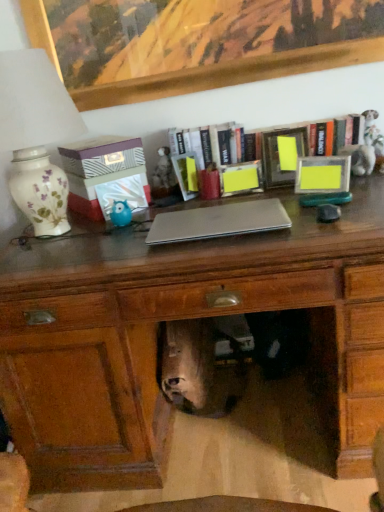
Question: Is matte wooden desk at center behind matte blue plastic owl at center-left?

Choices:
 (A) yes
 (B) no

Answer: (B)

Question: Does matte wooden desk at center have a larger size compared to matte blue plastic owl at center-left?

Choices:
 (A) yes
 (B) no

Answer: (A)

Question: Can you confirm if matte wooden desk at center is smaller than matte blue plastic owl at center-left?

Choices:
 (A) no
 (B) yes

Answer: (A)

Question: Does matte wooden desk at center have a greater width compared to matte blue plastic owl at center-left?

Choices:
 (A) yes
 (B) no

Answer: (A)

Question: From a real-world perspective, is matte wooden desk at center located beneath matte blue plastic owl at center-left?

Choices:
 (A) yes
 (B) no

Answer: (A)

Question: From the image's perspective, is matte wooden desk at center beneath matte blue plastic owl at center-left?

Choices:
 (A) yes
 (B) no

Answer: (A)

Question: Can you confirm if silver metallic laptop at center is positioned to the right of white floral ceramic lamp at left?

Choices:
 (A) no
 (B) yes

Answer: (B)

Question: Is silver metallic laptop at center thinner than white floral ceramic lamp at left?

Choices:
 (A) yes
 (B) no

Answer: (A)

Question: Can you see silver metallic laptop at center touching white floral ceramic lamp at left?

Choices:
 (A) yes
 (B) no

Answer: (B)

Question: From a real-world perspective, is silver metallic laptop at center positioned under white floral ceramic lamp at left based on gravity?

Choices:
 (A) no
 (B) yes

Answer: (B)

Question: Considering the relative positions of silver metallic laptop at center and white floral ceramic lamp at left in the image provided, is silver metallic laptop at center in front of white floral ceramic lamp at left?

Choices:
 (A) yes
 (B) no

Answer: (B)

Question: Does silver metallic laptop at center have a greater width compared to white floral ceramic lamp at left?

Choices:
 (A) no
 (B) yes

Answer: (A)

Question: From the image's perspective, is matte yellow picture frame at right, which is the first picture frame in right-to-left order, located above matte wooden desk at center?

Choices:
 (A) yes
 (B) no

Answer: (A)